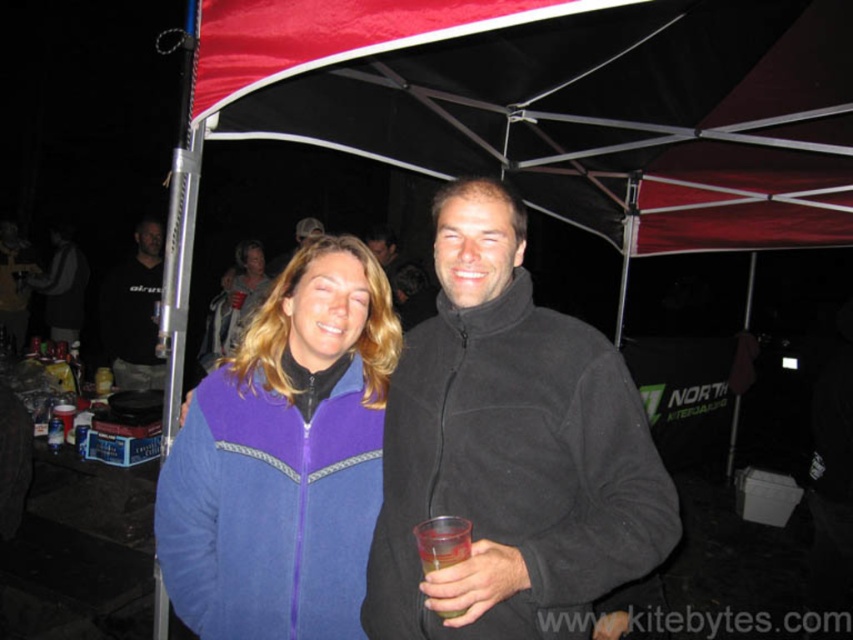
Question: Which point is farther to the camera?

Choices:
 (A) matte purple fleece jacket at upper center
 (B) black fleece jacket at left

Answer: (B)

Question: Is matte purple fleece jacket at upper center to the left of transparent plastic cup at center from the viewer's perspective?

Choices:
 (A) yes
 (B) no

Answer: (A)

Question: Based on their relative distances, which object is farther from the black fleece jacket at left?

Choices:
 (A) black fleece jacket at center
 (B) transparent plastic cup at center

Answer: (B)

Question: Estimate the real-world distances between objects in this image. Which object is farther from the purple fleece jacket at center?

Choices:
 (A) matte purple fleece jacket at upper center
 (B) black fleece jacket at center

Answer: (A)

Question: Does black fleece jacket at center have a larger size compared to matte purple fleece jacket at upper center?

Choices:
 (A) yes
 (B) no

Answer: (B)

Question: Is black fleece jacket at center smaller than transparent plastic cup at center?

Choices:
 (A) yes
 (B) no

Answer: (B)